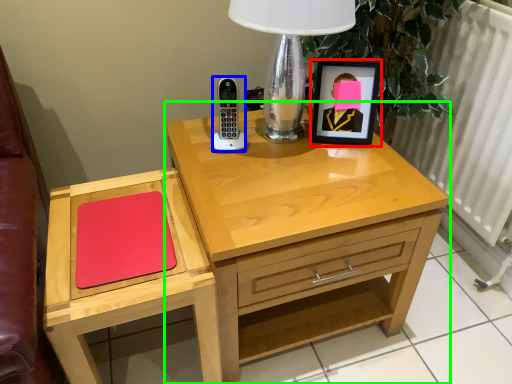
Question: Estimate the real-world distances between objects in this image. Which object is farther from picture frame (highlighted by a red box), control (highlighted by a blue box) or nightstand (highlighted by a green box)?

Choices:
 (A) control
 (B) nightstand

Answer: (B)